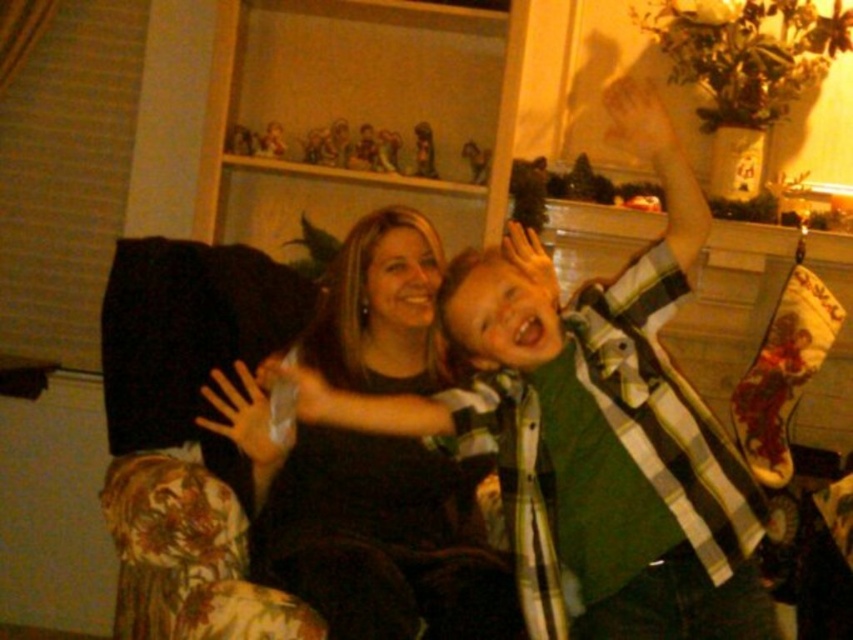
You are an interior designer planning to place a new lamp in the living room. The lamp requires a spot with at least 0.7 in both x and y coordinates to avoid blocking the view. Is the green plaid shirt at center positioned at a suitable location for placing the lamp?

The green plaid shirt at center is located at coordinates 0.670 in x and 0.695 in y. Since both values are below 0.7, the lamp cannot be placed there as it does not meet the required coordinates to avoid blocking the view.

You are designing a seating arrangement for a family photo shoot. The photographer wants to ensure that the green plaid shirt at center and the black matte shirt at center are visible in the frame. Given their sizes, which shirt should be placed closer to the camera to ensure both are fully visible?

The green plaid shirt at center is much taller than the black matte shirt at center. To ensure both are fully visible, the black matte shirt at center should be placed closer to the camera so that its smaller size doesn